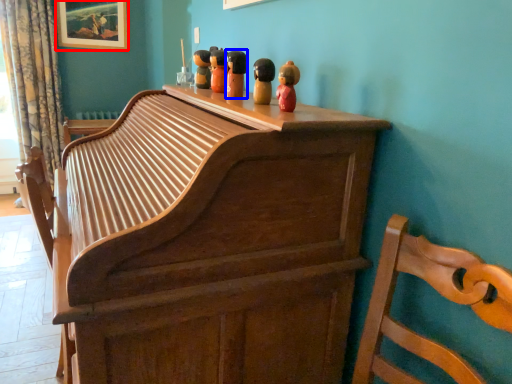
Question: Among these objects, which one is nearest to the camera, picture frame (highlighted by a red box) or toy (highlighted by a blue box)?

Choices:
 (A) picture frame
 (B) toy

Answer: (B)